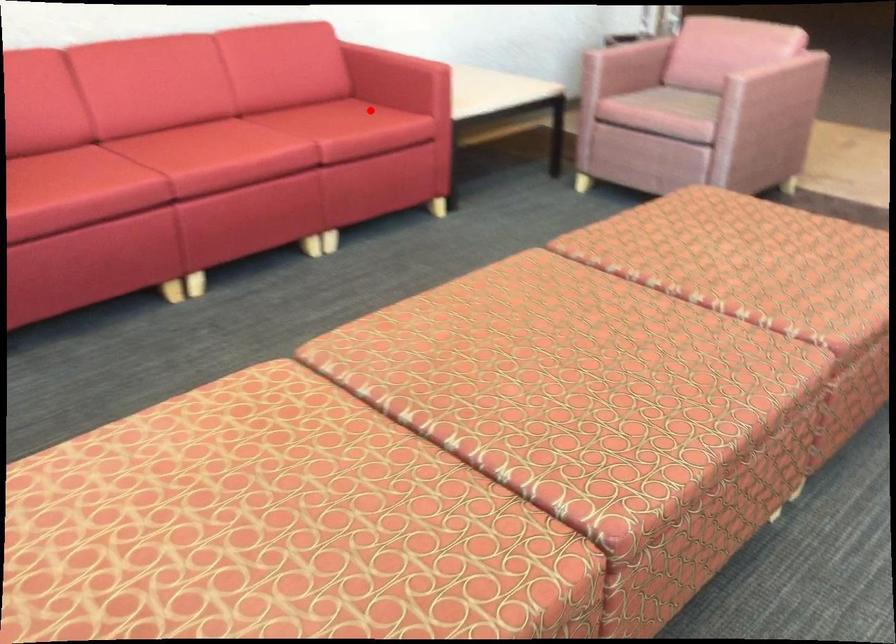
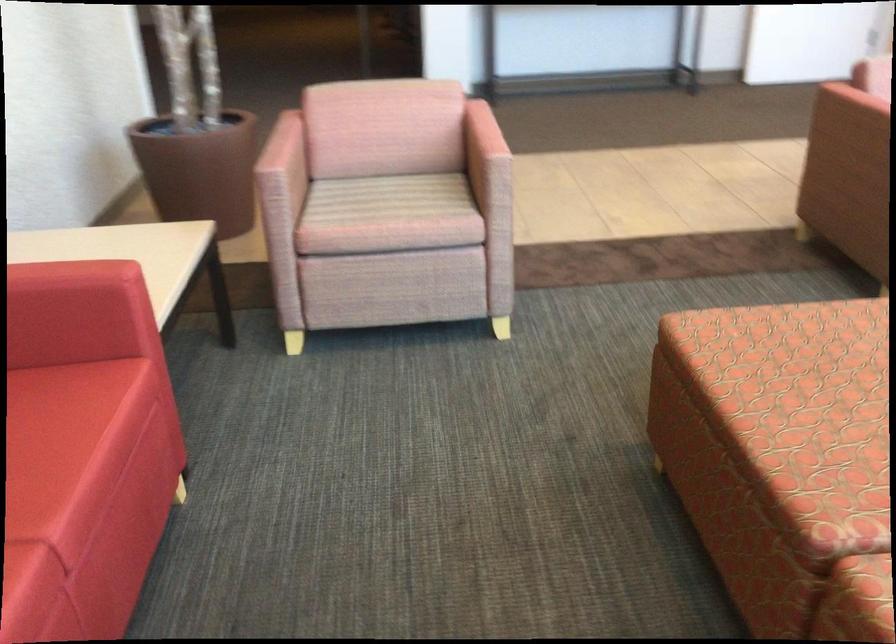
Where in the second image is the point corresponding to the highlighted location from the first image?

(38, 408)